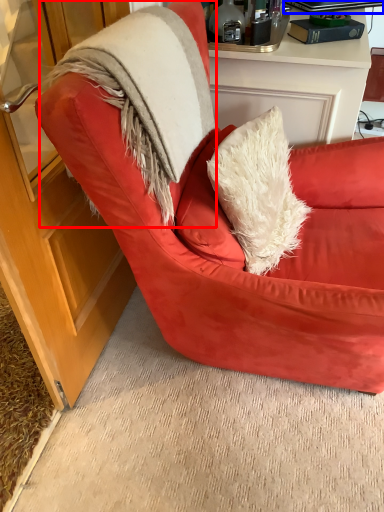
Question: Which object appears closest to the camera in this image, fur coat (highlighted by a red box) or laptop (highlighted by a blue box)?

Choices:
 (A) fur coat
 (B) laptop

Answer: (A)